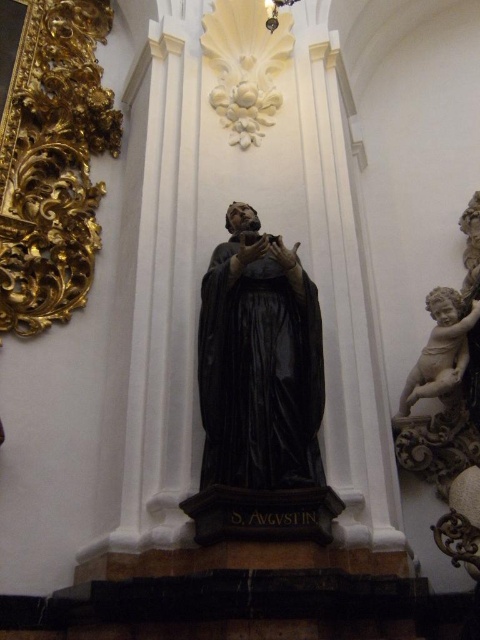
You are standing in the cathedral and want to take a photo of the statue of Saint Augustine. You notice two points marked on the wall. The first point is at coordinates point (241, 292) and the second point is at point (470, 314). Which point is closer to your camera when you take the photo?

Point (241, 292) is closer to the camera than point (470, 314).

You are an art conservator assessing the space for preservation needs. The black polished statue at center and the white marble cherub at right are both in need of protective coatings. Given their sizes, which object requires a larger quantity of coating material?

The black polished statue at center requires a larger quantity of coating material because it is larger in size than the white marble cherub at right.